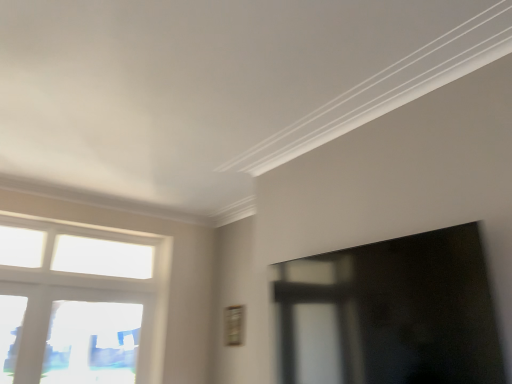
Question: Is transparent glass window screen at right smaller than transparent glass window at lower left, placed as the 2th window when sorted from top to bottom?

Choices:
 (A) yes
 (B) no

Answer: (B)

Question: From the image's perspective, is transparent glass window screen at right located beneath transparent glass window at lower left, acting as the first window starting from the bottom?

Choices:
 (A) yes
 (B) no

Answer: (B)

Question: Considering the relative sizes of transparent glass window screen at right and transparent glass window at lower left, placed as the 2th window when sorted from top to bottom, in the image provided, is transparent glass window screen at right wider than transparent glass window at lower left, placed as the 2th window when sorted from top to bottom,?

Choices:
 (A) yes
 (B) no

Answer: (A)

Question: Can you confirm if transparent glass window screen at right is taller than transparent glass window at lower left, placed as the 2th window when sorted from top to bottom?

Choices:
 (A) yes
 (B) no

Answer: (B)

Question: Would you say transparent glass window at lower left, placed as the 2th window when sorted from top to bottom, is part of transparent glass window screen at right's contents?

Choices:
 (A) no
 (B) yes

Answer: (A)

Question: From a real-world perspective, is transparent glass window at lower left, placed as the 2th window when sorted from top to bottom, physically located above or below white glass window at left, which appears as the second window when ordered from the bottom?

Choices:
 (A) above
 (B) below

Answer: (B)

Question: From the image's perspective, is transparent glass window at lower left, acting as the first window starting from the bottom, positioned above or below white glass window at left, which appears as the second window when ordered from the bottom?

Choices:
 (A) above
 (B) below

Answer: (B)

Question: Considering the positions of transparent glass window at lower left, placed as the 2th window when sorted from top to bottom, and white glass window at left, which appears as the second window when ordered from the bottom, in the image, is transparent glass window at lower left, placed as the 2th window when sorted from top to bottom, wider or thinner than white glass window at left, which appears as the second window when ordered from the bottom,?

Choices:
 (A) thin
 (B) wide

Answer: (A)

Question: In the image, is transparent glass window at lower left, acting as the first window starting from the bottom, on the left side or the right side of white glass window at left, arranged as the first window when viewed from the top?

Choices:
 (A) right
 (B) left

Answer: (A)

Question: Choose the correct answer: Is white glass window at left, arranged as the first window when viewed from the top, inside transparent glass window screen at right or outside it?

Choices:
 (A) inside
 (B) outside

Answer: (B)

Question: Based on their positions, is white glass window at left, which appears as the second window when ordered from the bottom, located to the left or right of transparent glass window screen at right?

Choices:
 (A) right
 (B) left

Answer: (B)

Question: From the image's perspective, relative to transparent glass window screen at right, is white glass window at left, arranged as the first window when viewed from the top, above or below?

Choices:
 (A) above
 (B) below

Answer: (B)

Question: In terms of height, does white glass window at left, arranged as the first window when viewed from the top, look taller or shorter compared to transparent glass window screen at right?

Choices:
 (A) short
 (B) tall

Answer: (B)

Question: Based on their sizes in the image, would you say transparent glass window screen at right is bigger or smaller than white glass window at left, which appears as the second window when ordered from the bottom?

Choices:
 (A) big
 (B) small

Answer: (A)

Question: From the image's perspective, is transparent glass window screen at right located above or below white glass window at left, arranged as the first window when viewed from the top?

Choices:
 (A) below
 (B) above

Answer: (B)